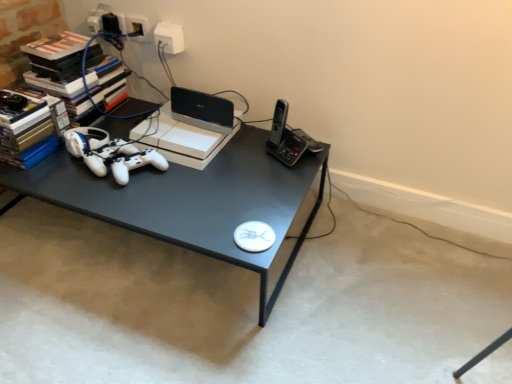
In order to click on vacant space in front of matte black desk at center in this screenshot , I will do `click(133, 325)`.